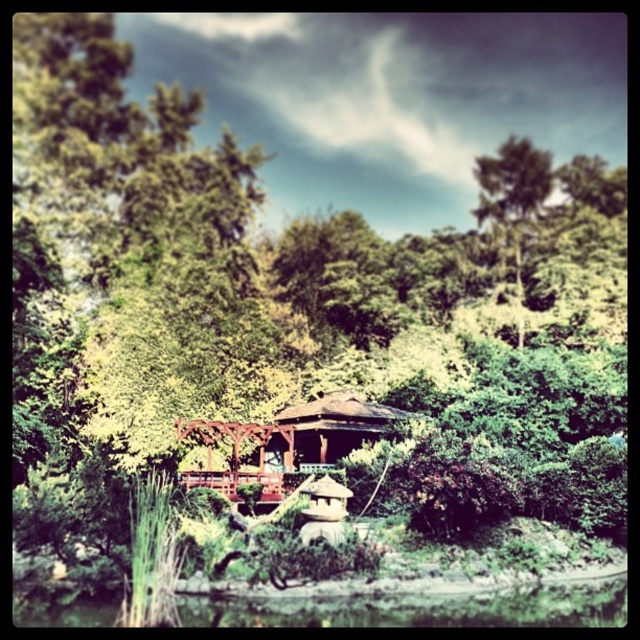
You are standing at the wooden gazebo at center and want to take a photo of the green leafy tree at upper right. Will the tree be fully visible in the photo without any obstruction from the gazebo?

The wooden gazebo at center is in front of the green leafy tree at upper right, so the tree will be partially obstructed by the gazebo and not fully visible in the photo.

In the garden scene, there is a green grassy river at lower center and a green leafy tree at upper right. Which of these two objects has a greater width?

The green grassy river at lower center has a greater width than the green leafy tree at upper right.

You are standing at the edge of the green grassy river at lower center and want to reach the wooden gazebo at center. Which direction should you move to get there?

You should move upward because the green grassy river at lower center is located below the wooden gazebo at center, so moving upward will take you towards the gazebo.